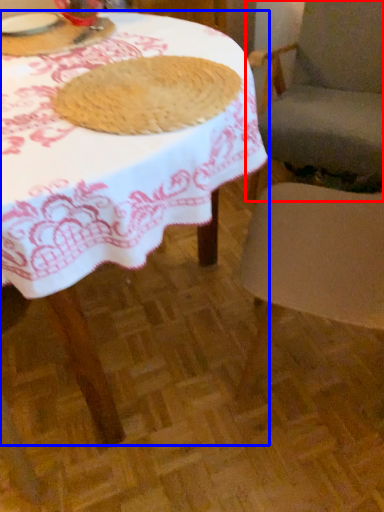
Question: Which of the following is the closest to the observer, chair (highlighted by a red box) or table (highlighted by a blue box)?

Choices:
 (A) chair
 (B) table

Answer: (B)